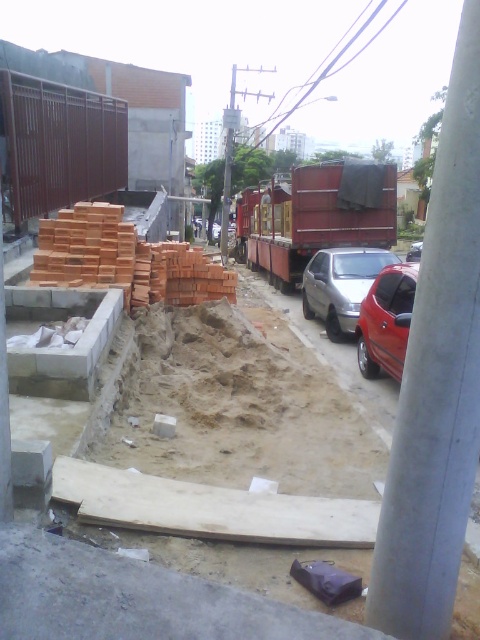
Does point (133, 387) lie in front of point (369, 330)?

Yes, point (133, 387) is in front of point (369, 330).

Is point (210, 388) less distant than point (380, 324)?

Yes, point (210, 388) is closer to viewer.

The height and width of the screenshot is (640, 480). I want to click on brown sandy at center, so click(239, 406).

Can you confirm if gray concrete pole at right is positioned below metallic silver car at center?

Yes.

Is gray concrete pole at right positioned at the back of metallic silver car at center?

No, it is not.

The width and height of the screenshot is (480, 640). What are the coordinates of `gray concrete pole at right` in the screenshot? It's located at (436, 384).

At what (x,y) coordinates should I click in order to perform the action: click on gray concrete pole at right. Please return your answer as a coordinate pair (x, y). This screenshot has height=640, width=480. Looking at the image, I should click on (436, 384).

Can you confirm if gray concrete pole at right is positioned to the left of glossy red car at right?

Yes, gray concrete pole at right is to the left of glossy red car at right.

Does gray concrete pole at right appear under glossy red car at right?

Correct, gray concrete pole at right is located below glossy red car at right.

Is point (479, 10) closer to camera compared to point (373, 285)?

That is True.

This screenshot has height=640, width=480. In order to click on gray concrete pole at right in this screenshot , I will do `click(436, 384)`.